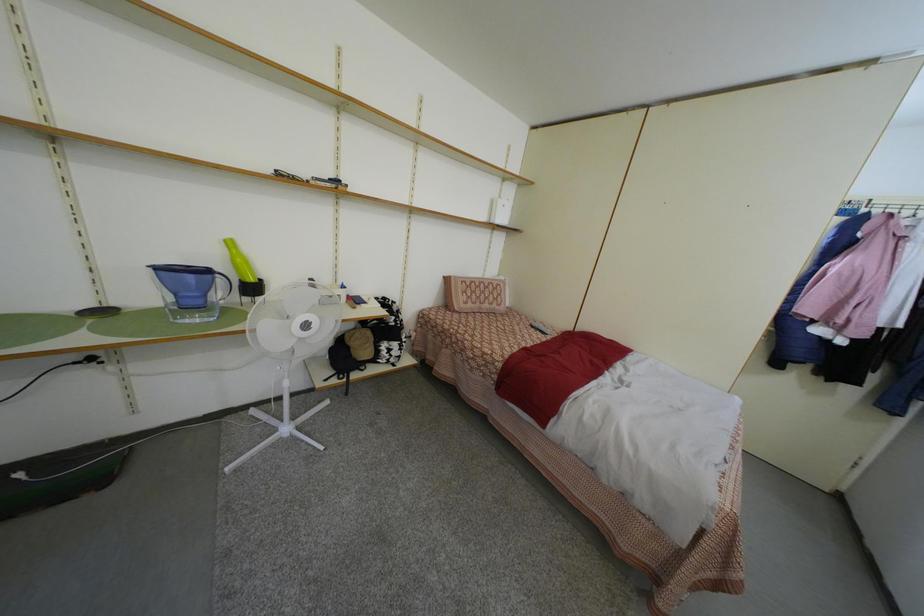
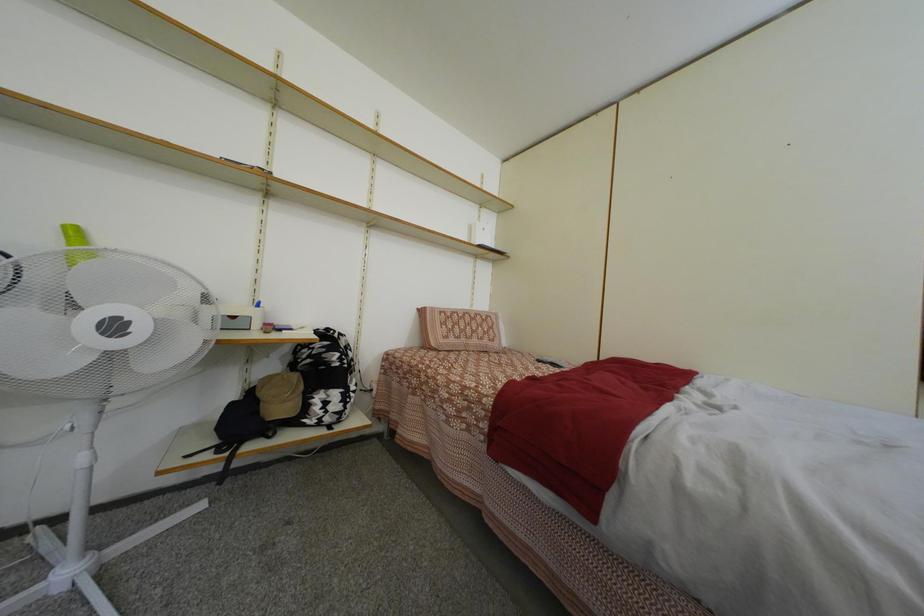
Question: The images are taken continuously from a first-person perspective. In which direction is your viewpoint rotating?

Choices:
 (A) Left
 (B) Right
 (C) Up
 (D) Down

Answer: (C)